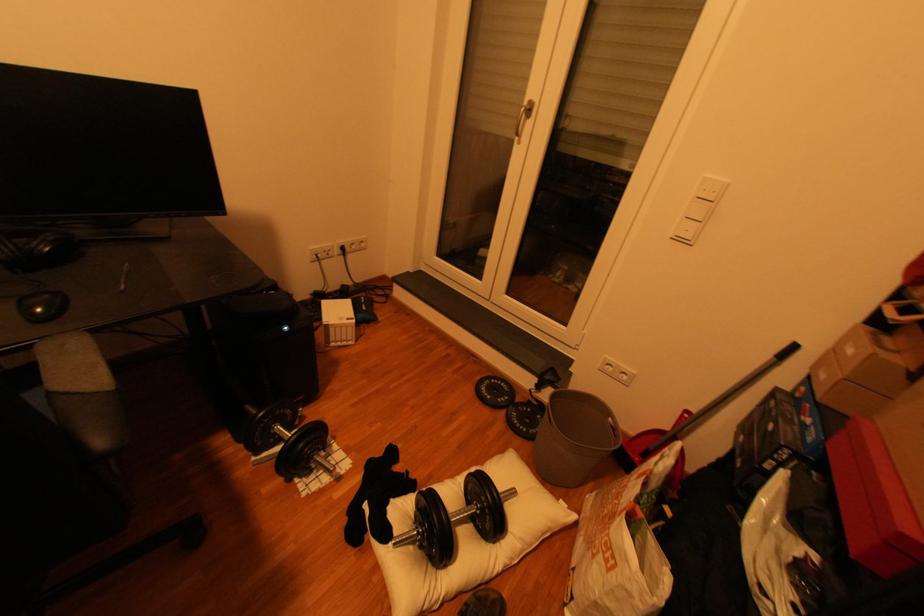
The width and height of the screenshot is (924, 616). What do you see at coordinates (523, 119) in the screenshot?
I see `the door handle` at bounding box center [523, 119].